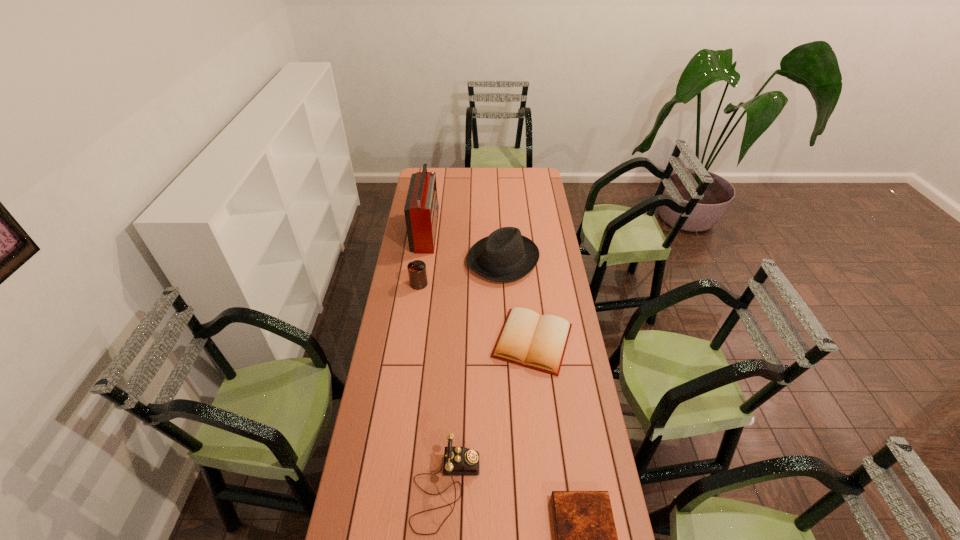
Locate an element on the screen. empty space that is in between the fifth tallest object and the telephone is located at coordinates (490, 415).

The height and width of the screenshot is (540, 960). Find the location of `free area in between the fourth farthest object and the fedora`. free area in between the fourth farthest object and the fedora is located at coordinates (517, 300).

You are a GUI agent. You are given a task and a screenshot of the screen. Output one action in this format:
    pyautogui.click(x=<x>, y=<y>)
    Task: Click on the free space between the fedora and the fourth tallest object
    The width and height of the screenshot is (960, 540).
    Given the screenshot: What is the action you would take?
    pyautogui.click(x=474, y=374)

You are a GUI agent. You are given a task and a screenshot of the screen. Output one action in this format:
    pyautogui.click(x=<x>, y=<y>)
    Task: Click on the empty space that is in between the fedora and the radio receiver
    Image resolution: width=960 pixels, height=540 pixels.
    Given the screenshot: What is the action you would take?
    pyautogui.click(x=465, y=246)

Identify the location of free area in between the tallest object and the can. This screenshot has width=960, height=540. (422, 258).

Where is `vacant region between the fedora and the radio receiver`? The height and width of the screenshot is (540, 960). vacant region between the fedora and the radio receiver is located at coordinates (465, 246).

Find the location of a particular element. This screenshot has width=960, height=540. empty space between the taller Bible and the tallest object is located at coordinates (479, 287).

Identify which object is the second closest to the telephone. Please provide its 2D coordinates. Your answer should be formatted as a tuple, i.e. [(x, y)], where the tuple contains the x and y coordinates of a point satisfying the conditions above.

[(538, 342)]

Locate which object is the fourth closest to the can. Please provide its 2D coordinates. Your answer should be formatted as a tuple, i.e. [(x, y)], where the tuple contains the x and y coordinates of a point satisfying the conditions above.

[(457, 460)]

At what (x,y) coordinates should I click in order to perform the action: click on vacant area in the image that satisfies the following two spatial constraints: 1. on the back side of the second shortest object; 2. on the front-facing side of the tallest object. Please return your answer as a coordinate pair (x, y). This screenshot has height=540, width=960. Looking at the image, I should click on (520, 232).